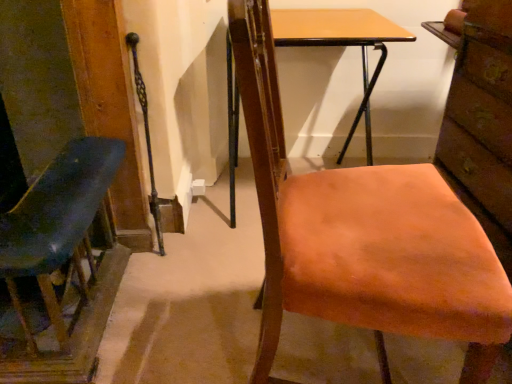
Question: Is point (372, 238) closer or farther from the camera than point (88, 317)?

Choices:
 (A) farther
 (B) closer

Answer: (B)

Question: In the image, is orange fabric chair at center, which ranks as the 2th chair in left-to-right order, positioned in front of or behind matte blue chair at left, the second chair when ordered from right to left?

Choices:
 (A) behind
 (B) front

Answer: (B)

Question: Which is nearer to the orange fabric chair at center, which ranks as the 2th chair in left-to-right order?

Choices:
 (A) matte blue chair at left, the second chair when ordered from right to left
 (B) brick textured drawer at right
 (C) light brown wood desk at center

Answer: (B)

Question: Which is nearer to the matte blue chair at left, arranged as the first chair when viewed from the left?

Choices:
 (A) brick textured drawer at right
 (B) light brown wood desk at center
 (C) orange fabric chair at center, which is the first chair from right to left

Answer: (C)